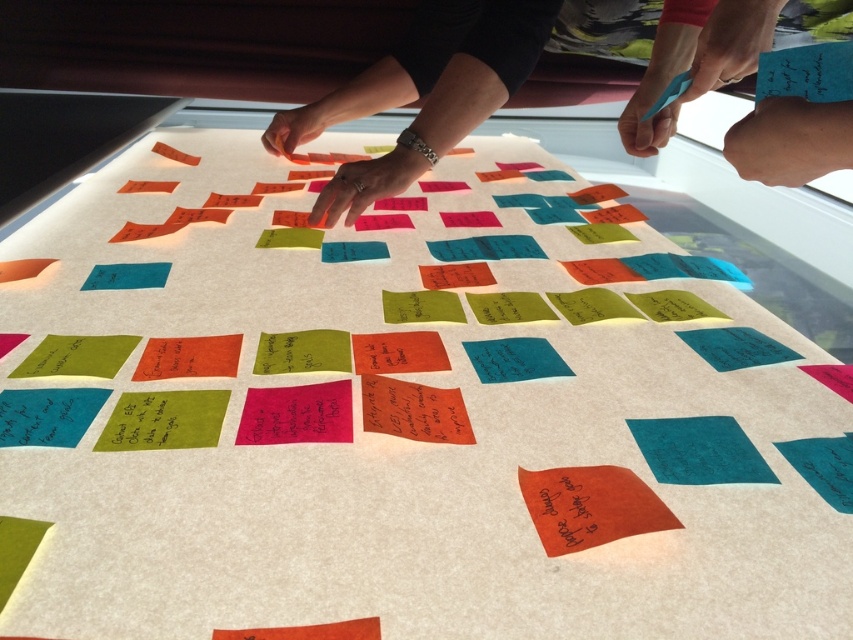
You are a participant in the brainstorming session and need to place a new sticky note between the smooth skin hands at upper center and the blue paper at upper right. Based on their positions, which object should you place the sticky note closer to?

You should place the sticky note closer to the blue paper at upper right because the smooth skin hands at upper center are taller than the blue paper at upper right, meaning the blue paper is lower in position.